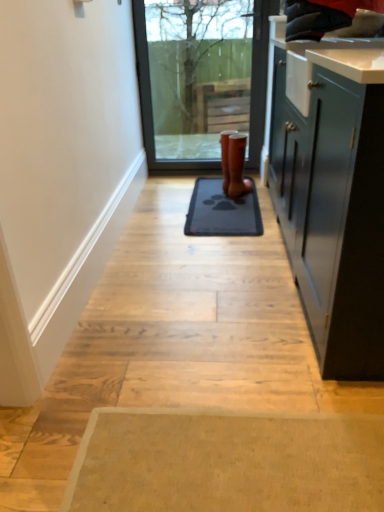
Question: Is gray rubber mat at center oriented away from brown leather boot at center?

Choices:
 (A) no
 (B) yes

Answer: (A)

Question: Is gray rubber mat at center to the left of brown leather boot at center from the viewer's perspective?

Choices:
 (A) yes
 (B) no

Answer: (A)

Question: Is brown leather boot at center completely or partially inside gray rubber mat at center?

Choices:
 (A) no
 (B) yes

Answer: (A)

Question: Does gray rubber mat at center have a larger size compared to brown leather boot at center?

Choices:
 (A) no
 (B) yes

Answer: (B)

Question: Considering the relative sizes of gray rubber mat at center and brown leather boot at center in the image provided, is gray rubber mat at center wider than brown leather boot at center?

Choices:
 (A) no
 (B) yes

Answer: (B)

Question: Considering the positions of gray rubber mat at center and brown leather boot at center in the image, is gray rubber mat at center wider or thinner than brown leather boot at center?

Choices:
 (A) thin
 (B) wide

Answer: (B)

Question: From the image's perspective, is gray rubber mat at center located above or below brown leather boot at center?

Choices:
 (A) above
 (B) below

Answer: (B)

Question: Is gray rubber mat at center situated inside brown leather boot at center or outside?

Choices:
 (A) outside
 (B) inside

Answer: (A)

Question: Is gray rubber mat at center taller or shorter than brown leather boot at center?

Choices:
 (A) tall
 (B) short

Answer: (B)

Question: Is transparent glass door at center to the left or to the right of gray rubber mat at center in the image?

Choices:
 (A) left
 (B) right

Answer: (A)

Question: Relative to gray rubber mat at center, is transparent glass door at center in front or behind?

Choices:
 (A) front
 (B) behind

Answer: (B)

Question: Is transparent glass door at center situated inside gray rubber mat at center or outside?

Choices:
 (A) outside
 (B) inside

Answer: (A)

Question: From the image's perspective, is transparent glass door at center positioned above or below gray rubber mat at center?

Choices:
 (A) below
 (B) above

Answer: (B)

Question: Which is correct: brown leather boot at center is inside transparent glass door at center, or outside of it?

Choices:
 (A) outside
 (B) inside

Answer: (A)

Question: From the image's perspective, relative to transparent glass door at center, is brown leather boot at center above or below?

Choices:
 (A) above
 (B) below

Answer: (B)